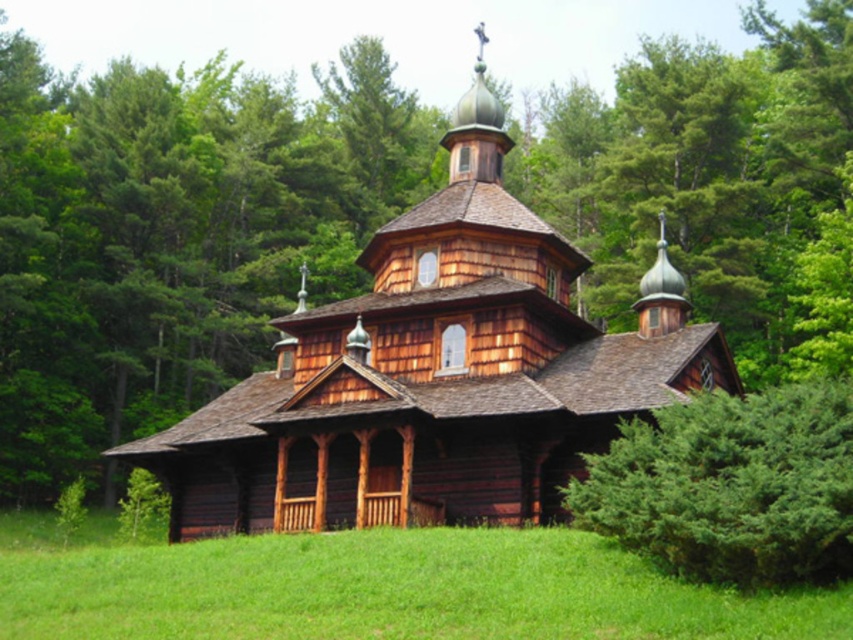
Question: Which point is closer to the camera?

Choices:
 (A) wooden church at center
 (B) green grass at lower center

Answer: (B)

Question: Does wooden church at center lie in front of green grass at lower center?

Choices:
 (A) no
 (B) yes

Answer: (A)

Question: Which of the following is the farthest from the observer?

Choices:
 (A) green grass at lower center
 (B) wooden church at center

Answer: (B)

Question: Does wooden church at center appear on the left side of green grass at lower center?

Choices:
 (A) yes
 (B) no

Answer: (B)

Question: Can you confirm if wooden church at center is positioned below green grass at lower center?

Choices:
 (A) yes
 (B) no

Answer: (B)

Question: Which point appears closest to the camera in this image?

Choices:
 (A) pos(410,330)
 (B) pos(521,550)

Answer: (B)